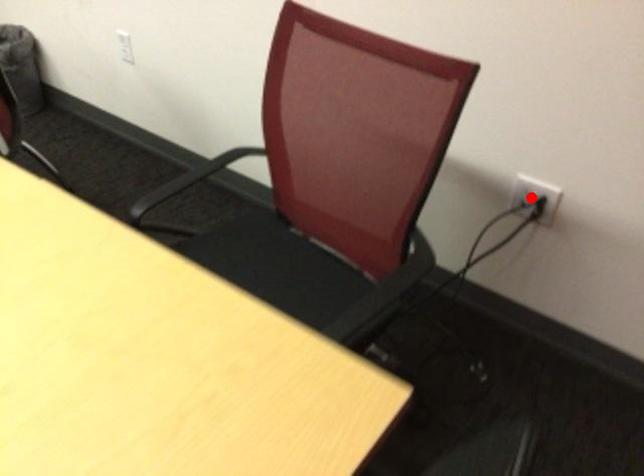
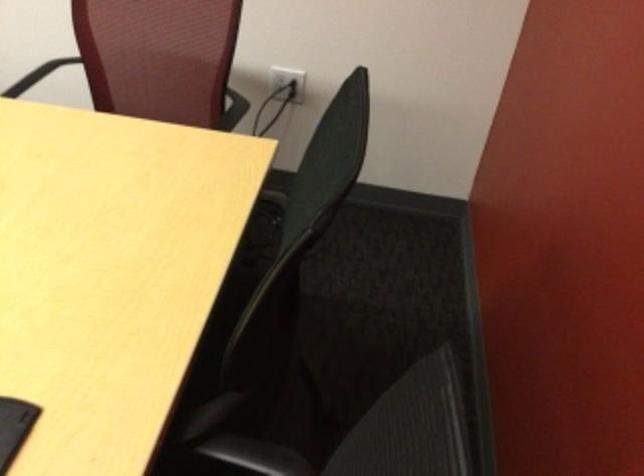
In the second image, find the point that corresponds to the highlighted location in the first image.

(288, 81)